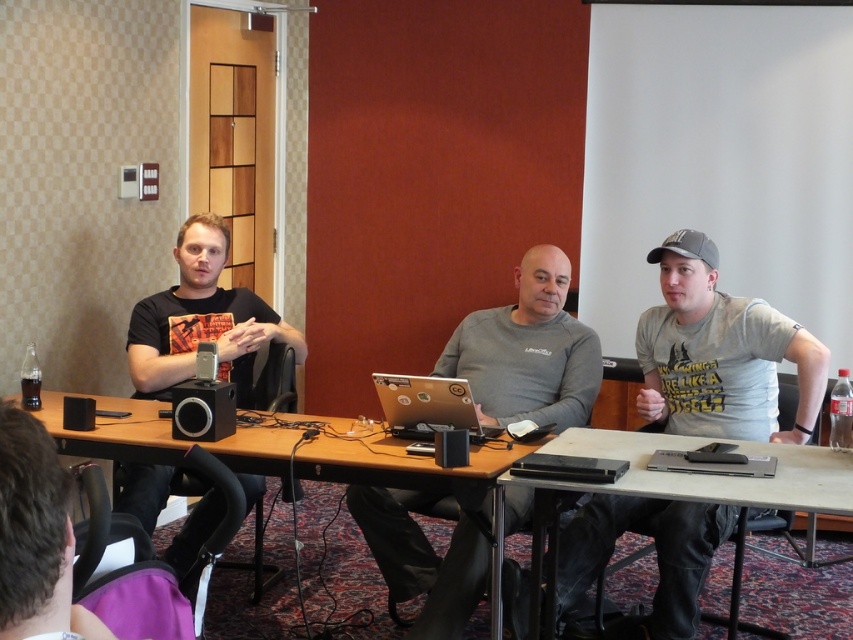
Question: Is wooden table at center to the right of satin black laptop at lower right from the viewer's perspective?

Choices:
 (A) yes
 (B) no

Answer: (B)

Question: Is black matte t-shirt at left wider than silver metallic laptop at center?

Choices:
 (A) yes
 (B) no

Answer: (A)

Question: Does gray matte shirt at center have a lesser width compared to matte black laptop at center?

Choices:
 (A) yes
 (B) no

Answer: (A)

Question: Based on their relative distances, which object is nearer to the black plastic laptop at center?

Choices:
 (A) matte black laptop at center
 (B) satin black laptop at lower right
 (C) silver metallic laptop at center

Answer: (A)

Question: Which of the following is the closest to the observer?

Choices:
 (A) gray cotton t-shirt at center
 (B) silver metallic laptop at center
 (C) black matte t-shirt at left
 (D) satin black laptop at lower right

Answer: (D)

Question: Which is farther from the black plastic laptop at center?

Choices:
 (A) matte black laptop at center
 (B) gray cotton t-shirt at center

Answer: (B)